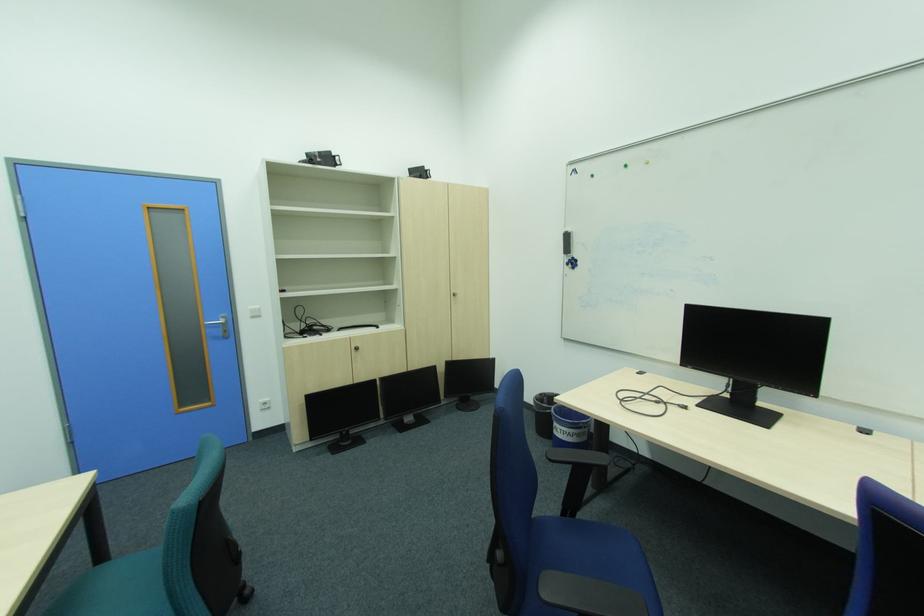
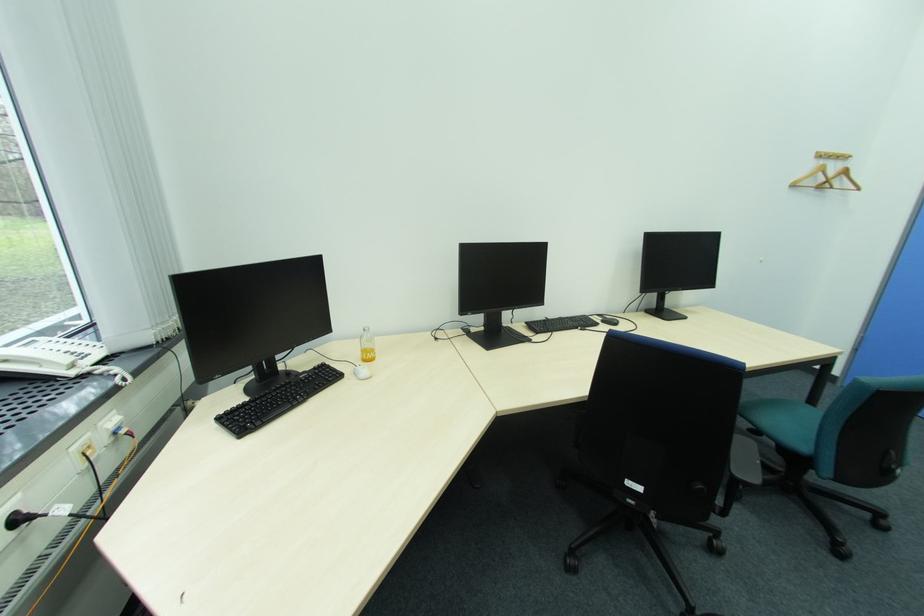
First-person continuous shooting, in which direction is the camera rotating?

The camera's rotation is toward left-down.